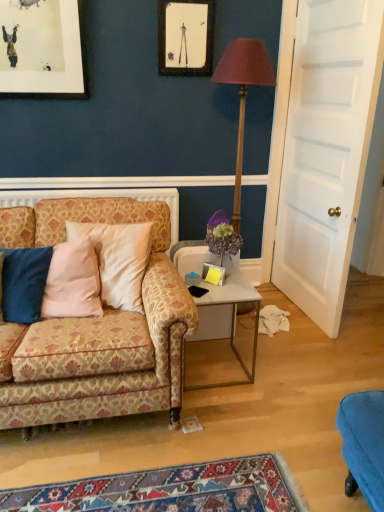
Question: Relative to white glossy side table at center, is matte black picture frame at upper center in front or behind?

Choices:
 (A) behind
 (B) front

Answer: (A)

Question: From the image's perspective, relative to white glossy side table at center, is matte black picture frame at upper center above or below?

Choices:
 (A) below
 (B) above

Answer: (B)

Question: Which object is the closest to the matte black picture frame at upper center?

Choices:
 (A) patterned fabric couch at left
 (B) white wooden door at right
 (C) wooden floor lamp at center
 (D) white glossy side table at center
 (E) matte purple vase at center

Answer: (C)

Question: Which object is positioned farthest from the white glossy side table at center?

Choices:
 (A) wooden floor lamp at center
 (B) matte black picture frame at upper center
 (C) white wooden door at right
 (D) patterned fabric couch at left
 (E) matte purple vase at center

Answer: (B)